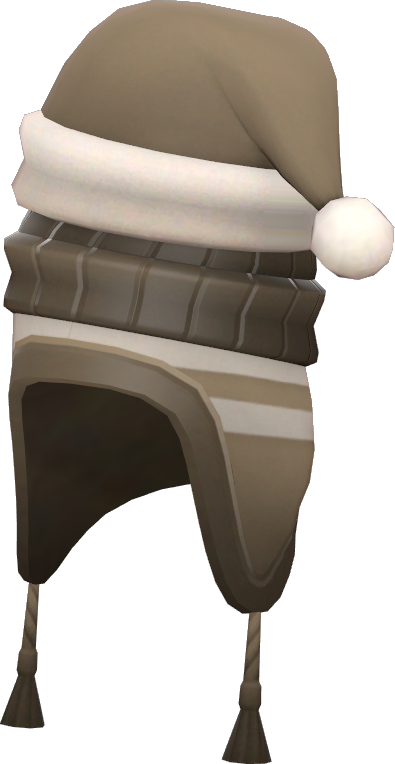
The width and height of the screenshot is (395, 764). Identify the location of tan section. (272, 487), (265, 384).